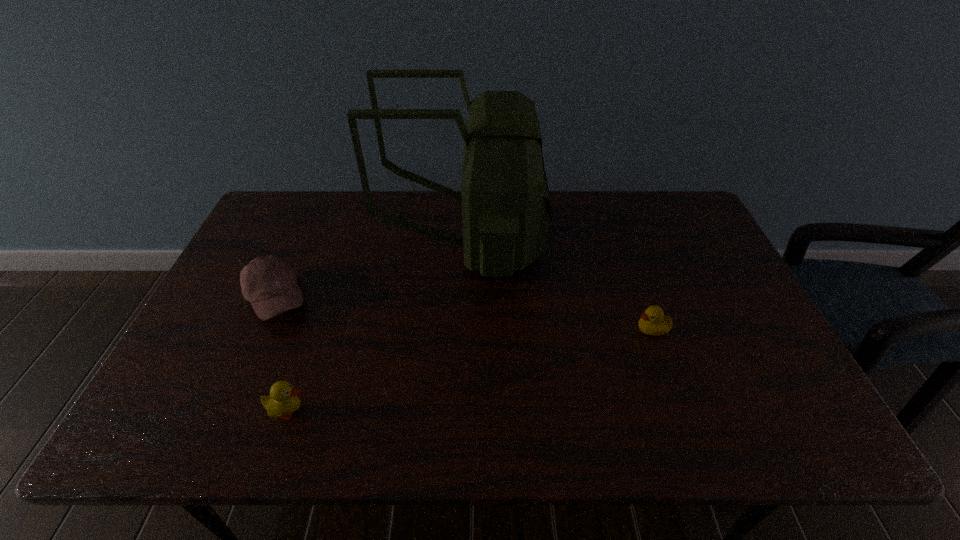
Locate an element on the screen. This screenshot has width=960, height=540. the tallest object is located at coordinates (506, 210).

The width and height of the screenshot is (960, 540). I want to click on the third object from left to right, so click(506, 210).

This screenshot has height=540, width=960. I want to click on baseball cap, so click(x=269, y=283).

I want to click on the nearest object, so click(x=283, y=400).

Identify the location of the nearer duckling. tap(283, 400).

Find the location of `the farther duckling`. the farther duckling is located at coordinates (653, 322).

Where is `the right duckling`? The image size is (960, 540). the right duckling is located at coordinates (653, 322).

This screenshot has width=960, height=540. What are the coordinates of `free space located 0.270m on the front pocket of the backpack` in the screenshot? It's located at (630, 247).

Identify the location of vacant position located on the front-facing side of the baseball cap. (437, 298).

Identify the location of free spot located 0.110m on the front-facing side of the left duckling. The width and height of the screenshot is (960, 540). (360, 411).